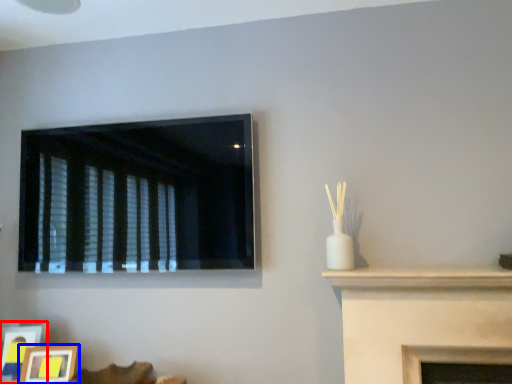
Question: Which object is closer to the camera taking this photo, picture frame (highlighted by a red box) or picture frame (highlighted by a blue box)?

Choices:
 (A) picture frame
 (B) picture frame

Answer: (B)